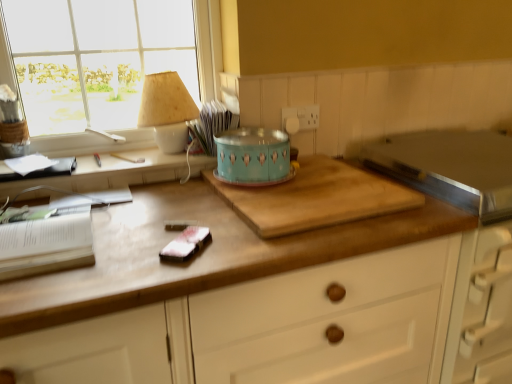
Locate an element on the screen. This screenshot has height=384, width=512. free space between white paper book at left and teal glossy cake tin at center, the first appliance positioned from the left is located at coordinates (156, 205).